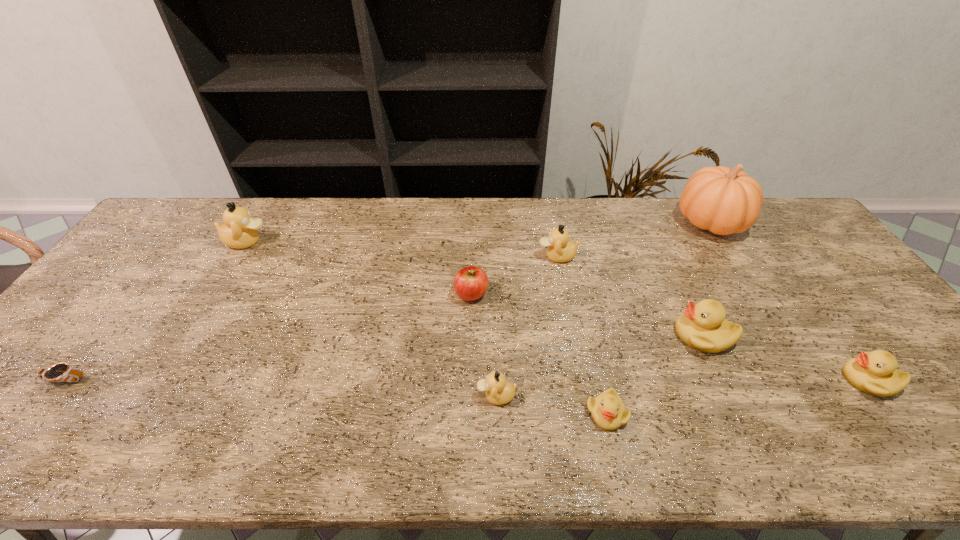
Find the location of a particular element. This screenshot has width=960, height=540. vacant space located 0.360m on the face of the second biggest tan duckling is located at coordinates (422, 256).

The image size is (960, 540). I want to click on free space located on the face of the second biggest tan duckling, so click(438, 256).

You are a GUI agent. You are given a task and a screenshot of the screen. Output one action in this format:
    pyautogui.click(x=<x>, y=<y>)
    Task: Click on the vacant position located 0.110m on the front-facing side of the biggest yellow duckling
    This screenshot has width=960, height=540.
    Given the screenshot: What is the action you would take?
    (633, 335)

Find the location of a particular element. The height and width of the screenshot is (540, 960). vacant space located on the front-facing side of the biggest yellow duckling is located at coordinates (525, 335).

I want to click on free space located on the front-facing side of the biggest yellow duckling, so click(x=579, y=335).

At what (x,y) coordinates should I click in order to perform the action: click on free spot located 0.110m on the left of the fourth farthest object. Please return your answer as a coordinate pair (x, y). Image resolution: width=960 pixels, height=540 pixels. Looking at the image, I should click on (416, 294).

Find the location of a particular element. This screenshot has width=960, height=540. vacant space situated on the front-facing side of the second smallest yellow duckling is located at coordinates (815, 380).

Find the location of a particular element. vacant space located 0.370m on the front-facing side of the second smallest yellow duckling is located at coordinates (689, 380).

Where is `free space located 0.380m on the front-facing side of the second smallest yellow duckling`? The height and width of the screenshot is (540, 960). free space located 0.380m on the front-facing side of the second smallest yellow duckling is located at coordinates (684, 380).

At what (x,y) coordinates should I click in order to perform the action: click on free space located 0.370m on the face of the second tan duckling from right to left. Please return your answer as a coordinate pair (x, y). The width and height of the screenshot is (960, 540). Looking at the image, I should click on (317, 396).